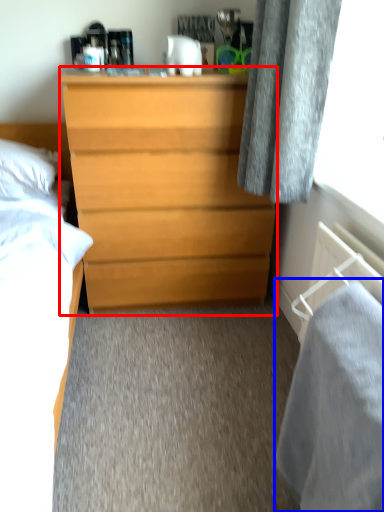
Question: Which object appears closest to the camera in this image, chest of drawers (highlighted by a red box) or sheet (highlighted by a blue box)?

Choices:
 (A) chest of drawers
 (B) sheet

Answer: (B)